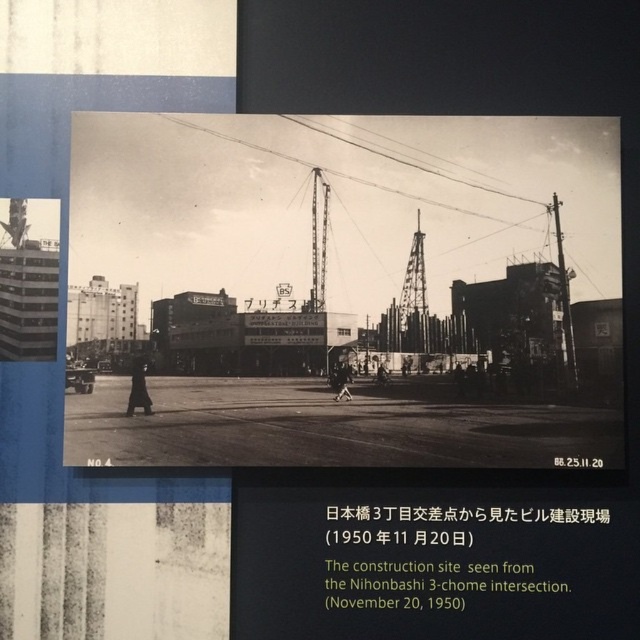
Question: Which object is closer to the camera taking this photo?

Choices:
 (A) metallic tower at center
 (B) metallic construction crane at center

Answer: (B)

Question: Is metallic tower at center positioned behind metallic construction crane at center?

Choices:
 (A) yes
 (B) no

Answer: (A)

Question: Which of the following is the farthest from the observer?

Choices:
 (A) (412, 301)
 (B) (321, 285)

Answer: (A)

Question: Is metallic tower at center wider than metallic construction crane at center?

Choices:
 (A) no
 (B) yes

Answer: (B)

Question: Does metallic tower at center appear on the right side of metallic construction crane at center?

Choices:
 (A) yes
 (B) no

Answer: (A)

Question: Among these points, which one is nearest to the camera?

Choices:
 (A) (417, 280)
 (B) (317, 285)

Answer: (A)